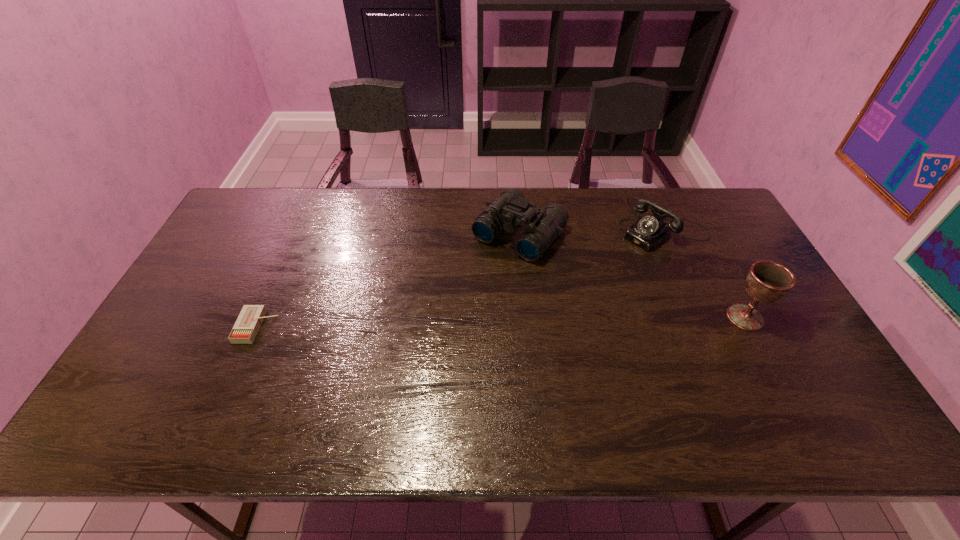
The height and width of the screenshot is (540, 960). I want to click on vacant space on the desktop that is between the matchbox and the chalice and is positioned through the lenses of the binoculars, so click(x=443, y=323).

The width and height of the screenshot is (960, 540). I want to click on free space on the desktop that is between the shortest object and the chalice and is positioned on the front-facing side of the telephone, so click(x=545, y=321).